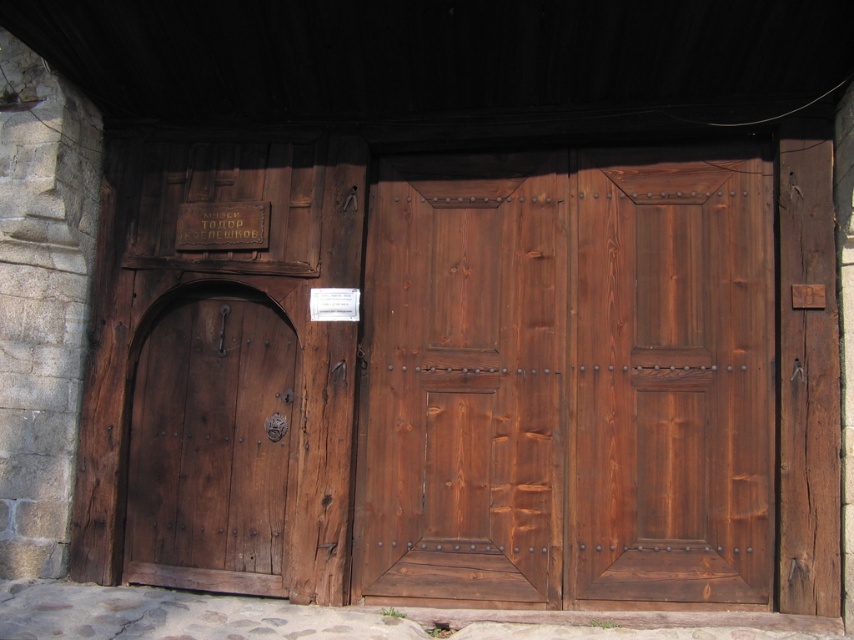
Question: Which point is closer to the camera?

Choices:
 (A) (461, 339)
 (B) (136, 516)
 (C) (689, 508)

Answer: (C)

Question: Estimate the real-world distances between objects in this image. Which object is farther from the dark brown wood door at left?

Choices:
 (A) satin wood door at center
 (B) stained wood door at center
 (C) satin brown wood door at center

Answer: (C)

Question: Can you confirm if stained wood door at center is positioned to the left of dark brown wood door at left?

Choices:
 (A) no
 (B) yes

Answer: (A)

Question: From the image, what is the correct spatial relationship of satin brown wood door at center in relation to dark brown wood door at left?

Choices:
 (A) left
 (B) right

Answer: (B)

Question: Does stained wood door at center come behind dark brown wood door at left?

Choices:
 (A) no
 (B) yes

Answer: (A)

Question: Among these objects, which one is nearest to the camera?

Choices:
 (A) satin wood door at center
 (B) satin brown wood door at center
 (C) stained wood door at center
 (D) dark brown wood door at left

Answer: (B)